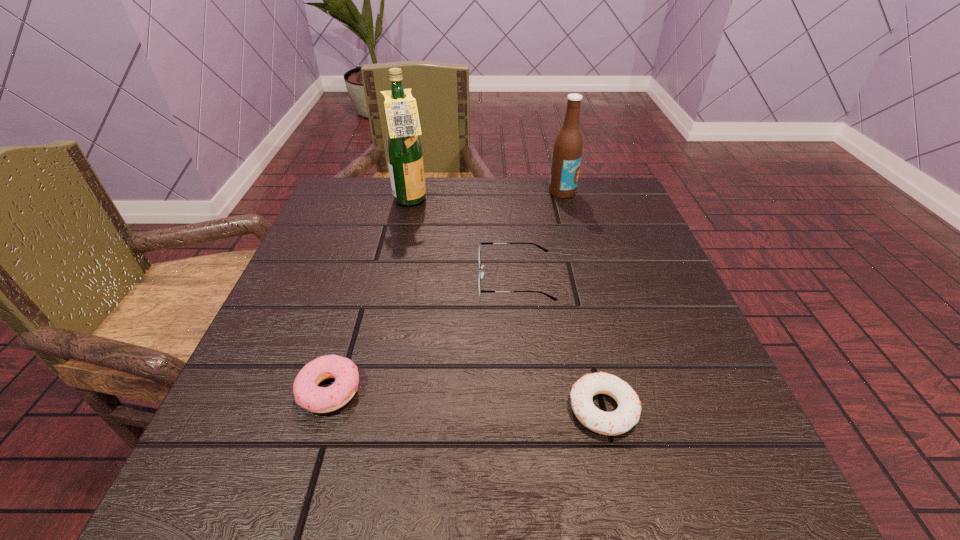
What are the coordinates of `free space that satisfies the following two spatial constraints: 1. on the front-facing side of the right doughnut; 2. on the left side of the tallest object` in the screenshot? It's located at (365, 409).

What are the coordinates of `vacant region that satisfies the following two spatial constraints: 1. on the front-facing side of the right doughnut; 2. on the right side of the tallest object` in the screenshot? It's located at (365, 409).

Where is `vacant space that satisfies the following two spatial constraints: 1. on the lenses of the right doughnut; 2. on the right side of the third shortest object`? The width and height of the screenshot is (960, 540). vacant space that satisfies the following two spatial constraints: 1. on the lenses of the right doughnut; 2. on the right side of the third shortest object is located at coordinates (527, 409).

Locate an element on the screen. This screenshot has width=960, height=540. vacant space that satisfies the following two spatial constraints: 1. on the back side of the right doughnut; 2. on the lenses of the third farthest object is located at coordinates (572, 279).

Find the location of a particular element. The height and width of the screenshot is (540, 960). vacant area in the image that satisfies the following two spatial constraints: 1. on the lenses of the third nearest object; 2. on the front side of the left doughnut is located at coordinates (525, 390).

Locate an element on the screen. This screenshot has width=960, height=540. free space in the image that satisfies the following two spatial constraints: 1. on the lenses of the spectacles; 2. on the front side of the left doughnut is located at coordinates (525, 390).